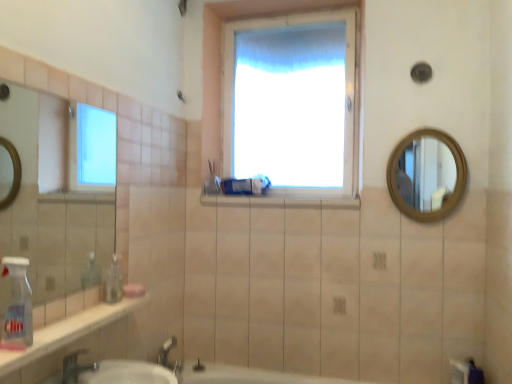
Question: Is white glossy window sill at center shorter than matte plastic toothbrush at center?

Choices:
 (A) yes
 (B) no

Answer: (A)

Question: Does white glossy window sill at center have a smaller size compared to matte plastic toothbrush at center?

Choices:
 (A) no
 (B) yes

Answer: (A)

Question: Are white glossy window sill at center and matte plastic toothbrush at center located far from each other?

Choices:
 (A) no
 (B) yes

Answer: (A)

Question: Considering the relative positions of white glossy window sill at center and matte plastic toothbrush at center in the image provided, is white glossy window sill at center behind matte plastic toothbrush at center?

Choices:
 (A) no
 (B) yes

Answer: (A)

Question: Is white glossy window sill at center positioned beyond the bounds of matte plastic toothbrush at center?

Choices:
 (A) no
 (B) yes

Answer: (B)

Question: In terms of size, does white plastic bottle at lower left appear bigger or smaller than white glossy window sill at center?

Choices:
 (A) small
 (B) big

Answer: (A)

Question: Is white plastic bottle at lower left situated inside white glossy window sill at center or outside?

Choices:
 (A) outside
 (B) inside

Answer: (A)

Question: Considering the relative positions of white plastic bottle at lower left and white glossy window sill at center in the image provided, is white plastic bottle at lower left to the left or to the right of white glossy window sill at center?

Choices:
 (A) left
 (B) right

Answer: (A)

Question: In the image, is white plastic bottle at lower left positioned in front of or behind white glossy window sill at center?

Choices:
 (A) front
 (B) behind

Answer: (A)

Question: Is pink matte soap at lower left spatially inside wooden round mirror at upper right, or outside of it?

Choices:
 (A) inside
 (B) outside

Answer: (B)

Question: Is pink matte soap at lower left bigger or smaller than wooden round mirror at upper right?

Choices:
 (A) small
 (B) big

Answer: (A)

Question: Is pink matte soap at lower left taller or shorter than wooden round mirror at upper right?

Choices:
 (A) tall
 (B) short

Answer: (B)

Question: From a real-world perspective, is pink matte soap at lower left above or below wooden round mirror at upper right?

Choices:
 (A) above
 (B) below

Answer: (B)

Question: Is point (275, 196) closer or farther from the camera than point (74, 354)?

Choices:
 (A) closer
 (B) farther

Answer: (B)

Question: Do you think white glossy window sill at center is within silver metallic faucet at lower left, or outside of it?

Choices:
 (A) inside
 (B) outside

Answer: (B)